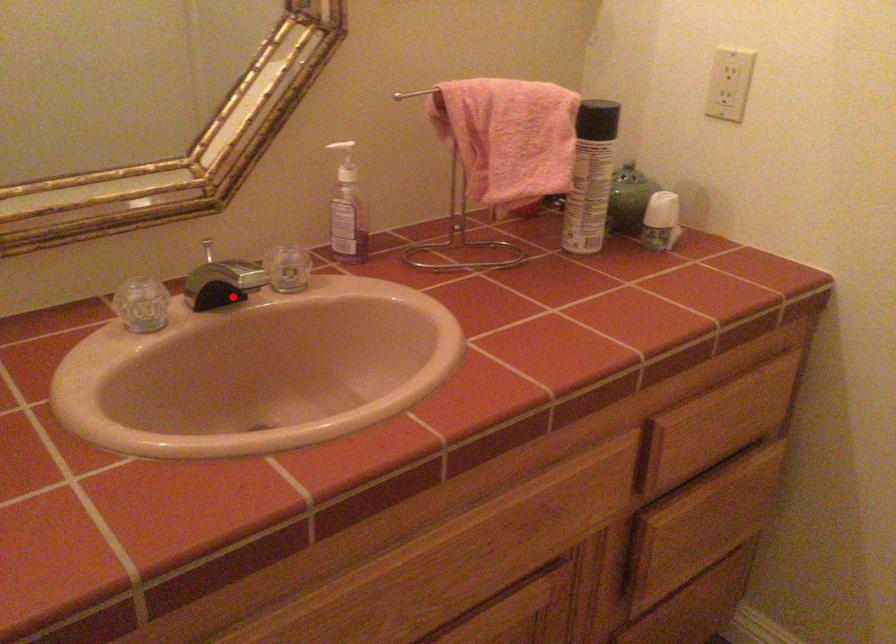
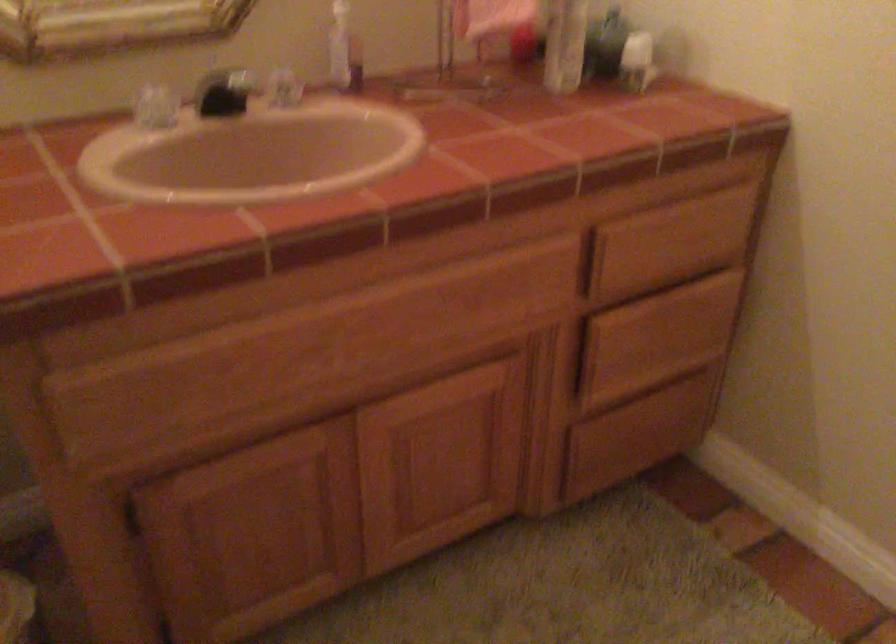
The point at the highlighted location is marked in the first image. Where is the corresponding point in the second image?

(225, 91)